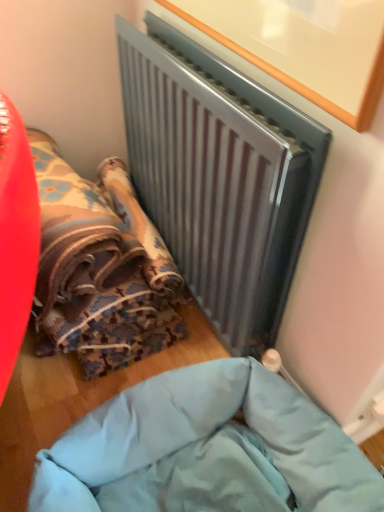
Question: Is metallic gray radiator at upper center further to camera compared to textured fabric bean bag at lower left?

Choices:
 (A) yes
 (B) no

Answer: (B)

Question: Considering the relative positions of metallic gray radiator at upper center and textured fabric bean bag at lower left in the image provided, is metallic gray radiator at upper center to the left of textured fabric bean bag at lower left from the viewer's perspective?

Choices:
 (A) yes
 (B) no

Answer: (B)

Question: Is textured fabric bean bag at lower left a part of metallic gray radiator at upper center?

Choices:
 (A) no
 (B) yes

Answer: (A)

Question: Is metallic gray radiator at upper center beside textured fabric bean bag at lower left?

Choices:
 (A) no
 (B) yes

Answer: (A)

Question: Is metallic gray radiator at upper center wider than textured fabric bean bag at lower left?

Choices:
 (A) yes
 (B) no

Answer: (B)

Question: Would you say light blue fabric at lower center is to the left or to the right of metallic gray radiator at upper center in the picture?

Choices:
 (A) right
 (B) left

Answer: (B)

Question: Is light blue fabric at lower center in front of or behind metallic gray radiator at upper center in the image?

Choices:
 (A) front
 (B) behind

Answer: (A)

Question: Considering the positions of light blue fabric at lower center and metallic gray radiator at upper center in the image, is light blue fabric at lower center wider or thinner than metallic gray radiator at upper center?

Choices:
 (A) thin
 (B) wide

Answer: (B)

Question: Considering the positions of point (304, 401) and point (276, 329), is point (304, 401) closer or farther from the camera than point (276, 329)?

Choices:
 (A) farther
 (B) closer

Answer: (B)

Question: From a real-world perspective, is textured fabric bean bag at lower left physically located above or below light blue fabric at lower center?

Choices:
 (A) above
 (B) below

Answer: (A)

Question: Visually, is textured fabric bean bag at lower left positioned to the left or to the right of light blue fabric at lower center?

Choices:
 (A) left
 (B) right

Answer: (A)

Question: From the image's perspective, is textured fabric bean bag at lower left located above or below light blue fabric at lower center?

Choices:
 (A) above
 (B) below

Answer: (A)

Question: Is textured fabric bean bag at lower left spatially inside light blue fabric at lower center, or outside of it?

Choices:
 (A) outside
 (B) inside

Answer: (A)

Question: In the image, is metallic gray radiator at upper center positioned in front of or behind textured fabric bean bag at lower left?

Choices:
 (A) front
 (B) behind

Answer: (A)

Question: From a real-world perspective, is metallic gray radiator at upper center above or below textured fabric bean bag at lower left?

Choices:
 (A) above
 (B) below

Answer: (A)